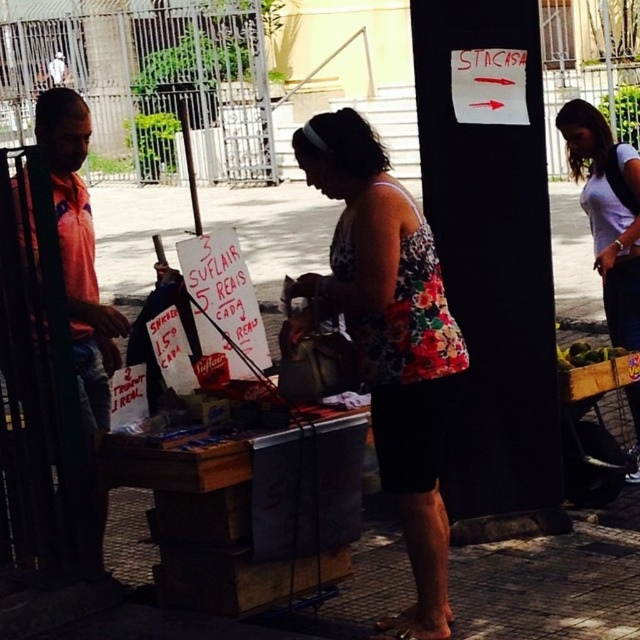
Is floral fabric dress at center in front of orange fabric shirt at left?

Yes.

Find the location of `floral fabric dress at center`. floral fabric dress at center is located at coordinates click(x=388, y=339).

Between floral fabric dress at center and white cotton shirt at right, which one is positioned higher?

white cotton shirt at right is higher up.

Between point (396, 202) and point (582, 113), which one is positioned behind?

The point (582, 113) is behind.

The width and height of the screenshot is (640, 640). I want to click on floral fabric dress at center, so click(x=388, y=339).

Is orange fabric shirt at left bigger than white cotton shirt at right?

No.

Is orange fabric shirt at left closer to the viewer compared to white cotton shirt at right?

Yes, orange fabric shirt at left is closer to the viewer.

Who is more forward, [61,97] or [636,161]?

Point [61,97]

Locate an element on the screen. This screenshot has width=640, height=640. orange fabric shirt at left is located at coordinates (74, 298).